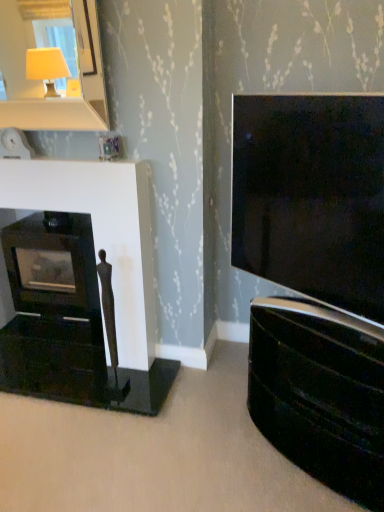
The width and height of the screenshot is (384, 512). What do you see at coordinates (320, 393) in the screenshot?
I see `glossy black tv cabinet at right` at bounding box center [320, 393].

At what (x,y) coordinates should I click in order to perform the action: click on matte black fireplace at left. Please return your answer as a coordinate pair (x, y). Looking at the image, I should click on (84, 288).

Describe the element at coordinates (84, 288) in the screenshot. I see `matte black fireplace at left` at that location.

Identify the location of glossy black tv cabinet at right. (320, 393).

Consider the image. What's the angular difference between matte black fireplace at left and white glossy mirror at upper left's facing directions?

They differ by 0.000263 degrees in their facing directions.

Is white glossy mirror at upper left inside matte black fireplace at left?

Actually, white glossy mirror at upper left is outside matte black fireplace at left.

Find the location of a particular element. This screenshot has width=384, height=512. mirror that appears above the matte black fireplace at left (from the image's perspective) is located at coordinates (42, 81).

Considering the relative sizes of matte black fireplace at left and white glossy mirror at upper left in the image provided, is matte black fireplace at left smaller than white glossy mirror at upper left?

Incorrect, matte black fireplace at left is not smaller in size than white glossy mirror at upper left.

Is white glossy mirror at upper left positioned beyond the bounds of glossy black tv cabinet at right?

Yes, white glossy mirror at upper left is not within glossy black tv cabinet at right.

Relative to glossy black tv cabinet at right, is white glossy mirror at upper left in front or behind?

In the image, white glossy mirror at upper left appears behind glossy black tv cabinet at right.

Would you consider white glossy mirror at upper left to be distant from glossy black tv cabinet at right?

Yes, white glossy mirror at upper left and glossy black tv cabinet at right are quite far apart.

Does glossy black tv cabinet at right turn towards white glossy mirror at upper left?

No, glossy black tv cabinet at right does not turn towards white glossy mirror at upper left.

From the image's perspective, which is above, glossy black tv cabinet at right or white glossy mirror at upper left?

From the image's view, white glossy mirror at upper left is above.

Which object is thinner, glossy black tv cabinet at right or white glossy mirror at upper left?

With smaller width is white glossy mirror at upper left.

Which is in front, glossy black tv cabinet at right or white glossy mirror at upper left?

glossy black tv cabinet at right is in front.

Can you tell me how much white glossy mirror at upper left and matte black fireplace at left differ in facing direction?

They differ by 0.000263 degrees in their facing directions.

Can you confirm if white glossy mirror at upper left is thinner than matte black fireplace at left?

In fact, white glossy mirror at upper left might be wider than matte black fireplace at left.

From the image's perspective, is white glossy mirror at upper left positioned above or below matte black fireplace at left?

Clearly, from the image's perspective, white glossy mirror at upper left is above matte black fireplace at left.

Is point (349, 232) in front of point (41, 238)?

Yes, point (349, 232) is closer to viewer.

Could you tell me if matte black tv at right is turned towards matte black fireplace at left?

No, matte black tv at right is not turned towards matte black fireplace at left.

Does matte black tv at right have a smaller size compared to matte black fireplace at left?

No.

From the image's perspective, which is above, matte black tv at right or matte black fireplace at left?

matte black tv at right, from the image's perspective.

Is there a large distance between matte black tv at right and glossy black tv cabinet at right?

No, matte black tv at right is not far away from glossy black tv cabinet at right.

Considering the relative positions of matte black tv at right and glossy black tv cabinet at right in the image provided, is matte black tv at right to the right of glossy black tv cabinet at right from the viewer's perspective?

In fact, matte black tv at right is to the left of glossy black tv cabinet at right.

Can you tell me how much matte black tv at right and glossy black tv cabinet at right differ in facing direction?

They differ by 1.19 degrees in their facing directions.

From a real-world perspective, is matte black tv at right located beneath glossy black tv cabinet at right?

No.

Based on the photo, is white glossy mirror at upper left positioned in front of matte black tv at right?

A: No.

Who is taller, white glossy mirror at upper left or matte black tv at right?

matte black tv at right is taller.

Consider the image. Can we say white glossy mirror at upper left lies outside matte black tv at right?

Absolutely, white glossy mirror at upper left is external to matte black tv at right.

In order to click on mirror behind the matte black tv at right in this screenshot , I will do `click(42, 81)`.

You are a GUI agent. You are given a task and a screenshot of the screen. Output one action in this format:
    pyautogui.click(x=<x>, y=<y>)
    Task: Click on the mirror in front of the matte black fireplace at left
    
    Given the screenshot: What is the action you would take?
    pyautogui.click(x=42, y=81)

Locate an element on the screen. tv cabinet below the white glossy mirror at upper left (from a real-world perspective) is located at coordinates (320, 393).

Considering their positions, is matte black fireplace at left positioned further to white glossy mirror at upper left than matte black tv at right?

matte black tv at right lies further to white glossy mirror at upper left than the other object.

Estimate the real-world distances between objects in this image. Which object is further from matte black fireplace at left, matte black tv at right or glossy black tv cabinet at right?

glossy black tv cabinet at right.

Based on their spatial positions, is matte black fireplace at left or matte black tv at right closer to glossy black tv cabinet at right?

The object closer to glossy black tv cabinet at right is matte black tv at right.

Based on their spatial positions, is matte black tv at right or matte black fireplace at left closer to glossy black tv cabinet at right?

Among the two, matte black tv at right is located nearer to glossy black tv cabinet at right.

Estimate the real-world distances between objects in this image. Which object is further from white glossy mirror at upper left, matte black tv at right or matte black fireplace at left?

matte black tv at right is further to white glossy mirror at upper left.

From the image, which object appears to be nearer to matte black tv at right, white glossy mirror at upper left or glossy black tv cabinet at right?

Based on the image, glossy black tv cabinet at right appears to be nearer to matte black tv at right.

Which object lies nearer to the anchor point matte black tv at right, white glossy mirror at upper left or matte black fireplace at left?

matte black fireplace at left.

From the image, which object appears to be farther from matte black fireplace at left, glossy black tv cabinet at right or white glossy mirror at upper left?

white glossy mirror at upper left.

Find the location of a particular element. television that lies between white glossy mirror at upper left and glossy black tv cabinet at right from top to bottom is located at coordinates (311, 196).

This screenshot has width=384, height=512. I want to click on television between matte black fireplace at left and glossy black tv cabinet at right in the horizontal direction, so click(x=311, y=196).

Where is `mirror between matte black fireplace at left and matte black tv at right from left to right`? The width and height of the screenshot is (384, 512). mirror between matte black fireplace at left and matte black tv at right from left to right is located at coordinates (42, 81).

At what (x,y) coordinates should I click in order to perform the action: click on mirror situated between matte black fireplace at left and glossy black tv cabinet at right from left to right. Please return your answer as a coordinate pair (x, y). The height and width of the screenshot is (512, 384). Looking at the image, I should click on pos(42,81).